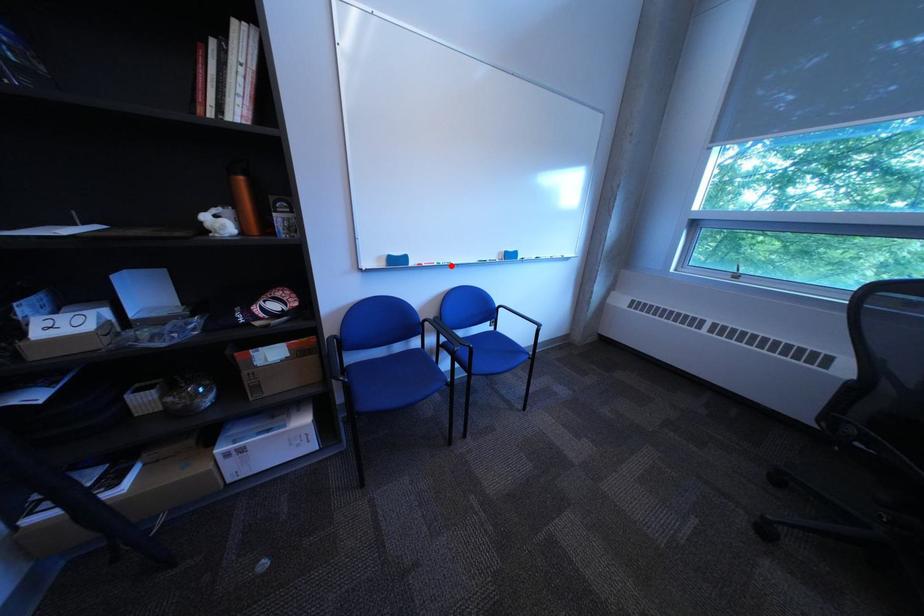
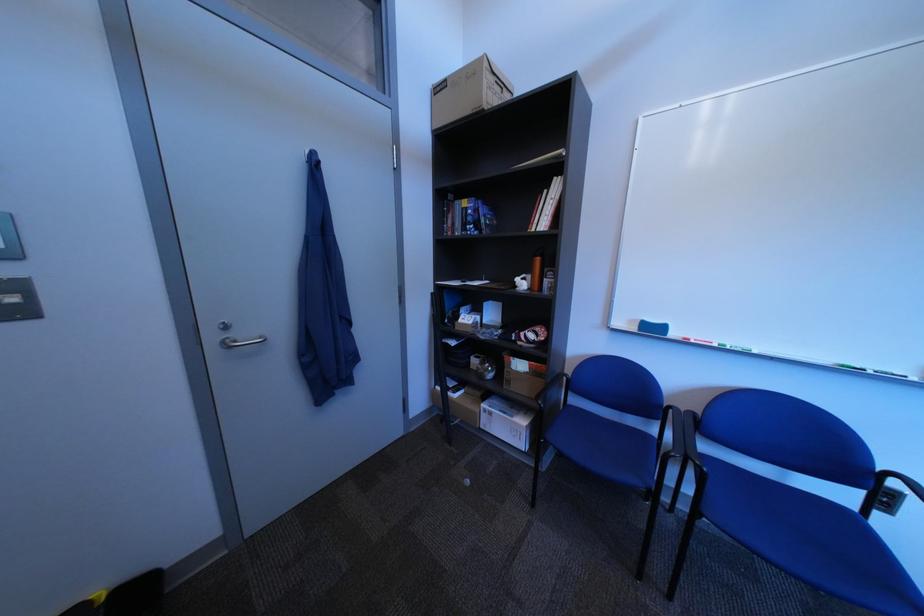
Find the pixel in the second image that matches the highlighted location in the first image.

(732, 347)